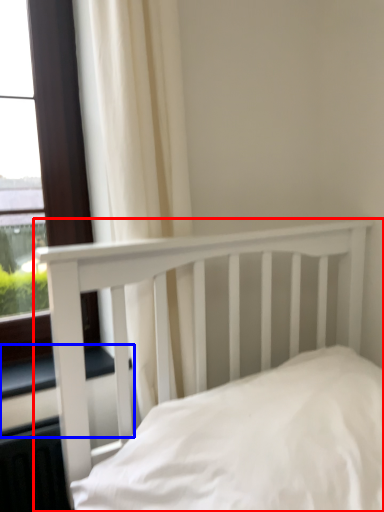
Question: Which point is closer to the camera, bed (highlighted by a red box) or window sill (highlighted by a blue box)?

Choices:
 (A) bed
 (B) window sill

Answer: (A)